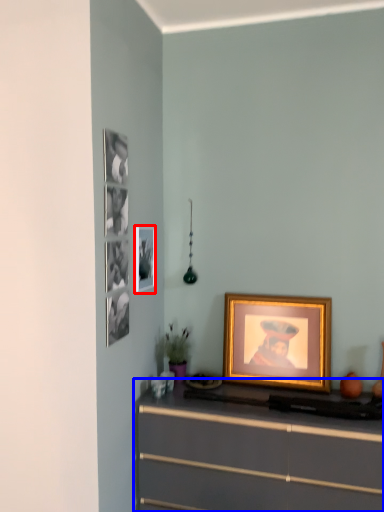
Question: Which object is further to the camera taking this photo, picture frame (highlighted by a red box) or chest of drawers (highlighted by a blue box)?

Choices:
 (A) picture frame
 (B) chest of drawers

Answer: (A)